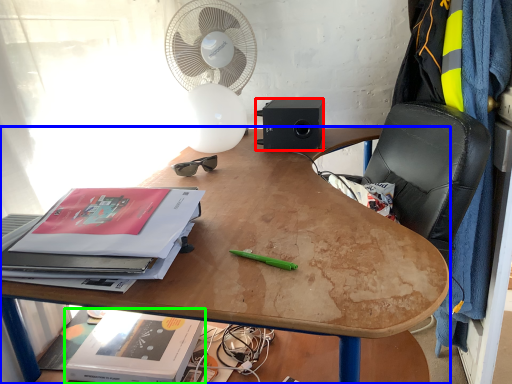
Question: Based on their relative distances, which object is farther from loudspeaker (highlighted by a red box)? Choose from desk (highlighted by a blue box) and paperback book (highlighted by a green box).

Choices:
 (A) desk
 (B) paperback book

Answer: (B)